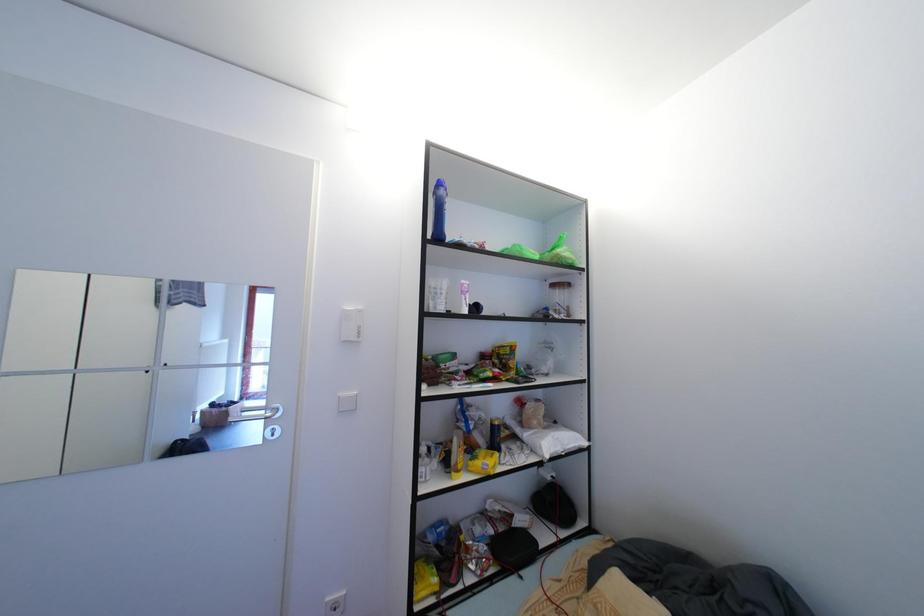
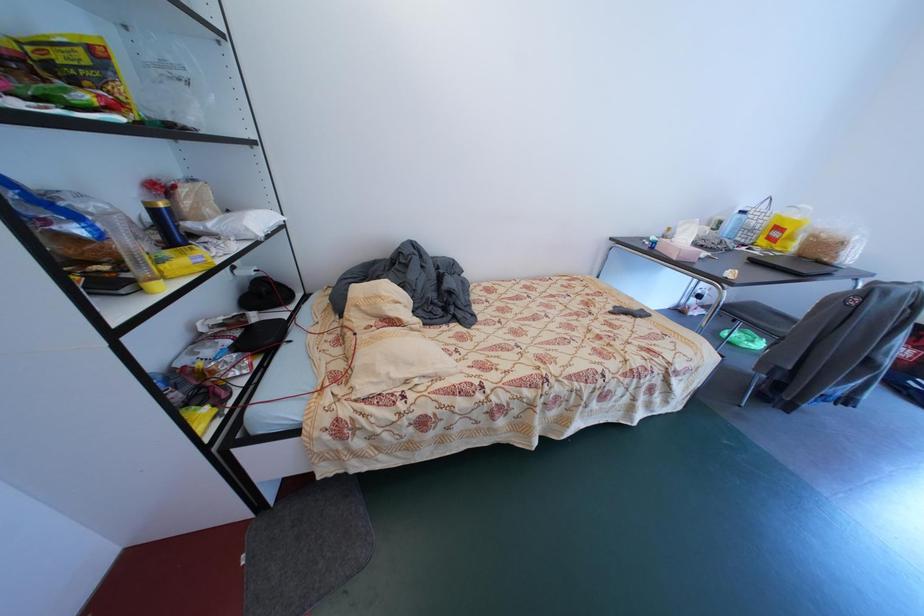
Based on the continuous images, in which direction is the camera rotating?

The camera rotated toward right-down.